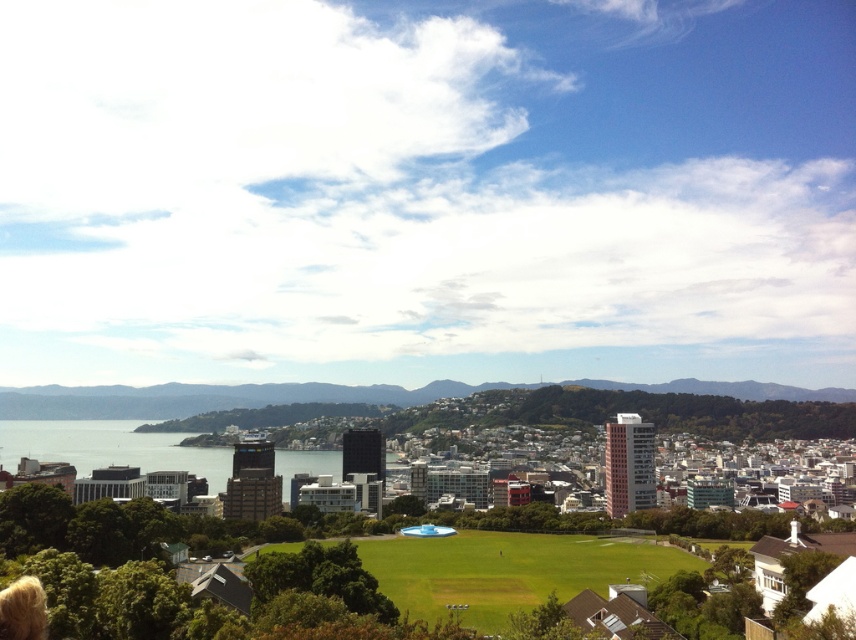
You are a city planner assessing the image for potential development. You notice the green grass field at center and the transparent glass water at center. Which of these two features is lower in elevation?

The green grass field at center is shorter than transparent glass water at center, so the green grass field at center has a lower elevation.

You are standing at the point with coordinates point at (x=508, y=570) in the cityscape image. What is the immediate surface you are standing on?

The point at (x=508, y=570) corresponds to the green grass field at center, so you are standing on the green grass field at center.